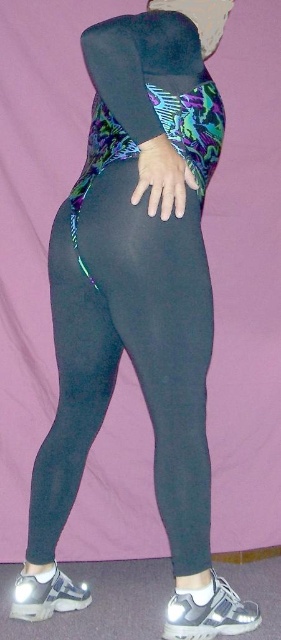
Question: Does black matte leggings at center appear on the right side of matte black hand at center?

Choices:
 (A) yes
 (B) no

Answer: (B)

Question: Is black matte leggings at center to the left of matte black hand at center from the viewer's perspective?

Choices:
 (A) no
 (B) yes

Answer: (B)

Question: Which point is closer to the camera?

Choices:
 (A) (182, 493)
 (B) (177, 186)

Answer: (B)

Question: Which of the following is the farthest from the observer?

Choices:
 (A) (68, 280)
 (B) (139, 180)

Answer: (A)

Question: Which of the following is the farthest from the observer?

Choices:
 (A) (76, 273)
 (B) (175, 205)

Answer: (A)

Question: Is black matte leggings at center positioned before matte black hand at center?

Choices:
 (A) yes
 (B) no

Answer: (B)